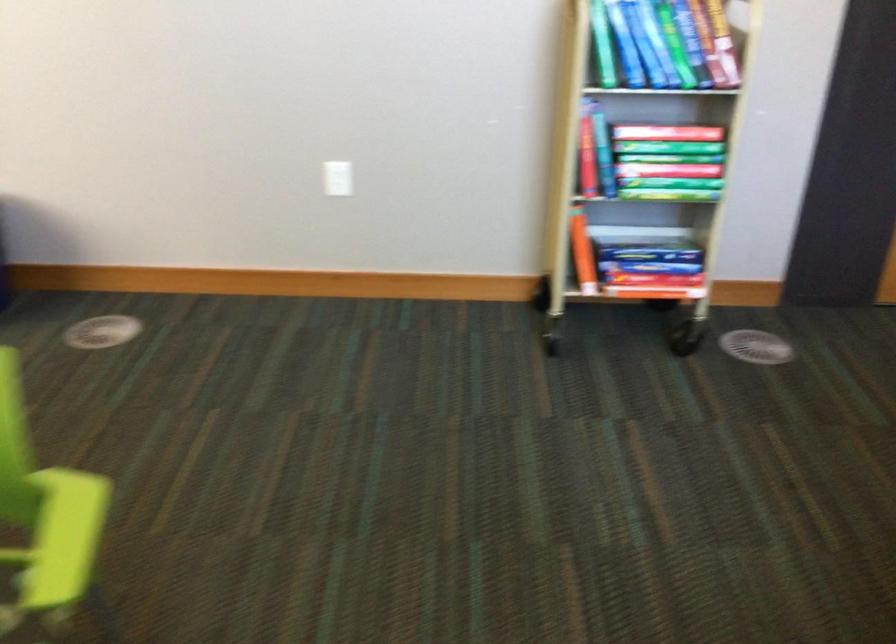
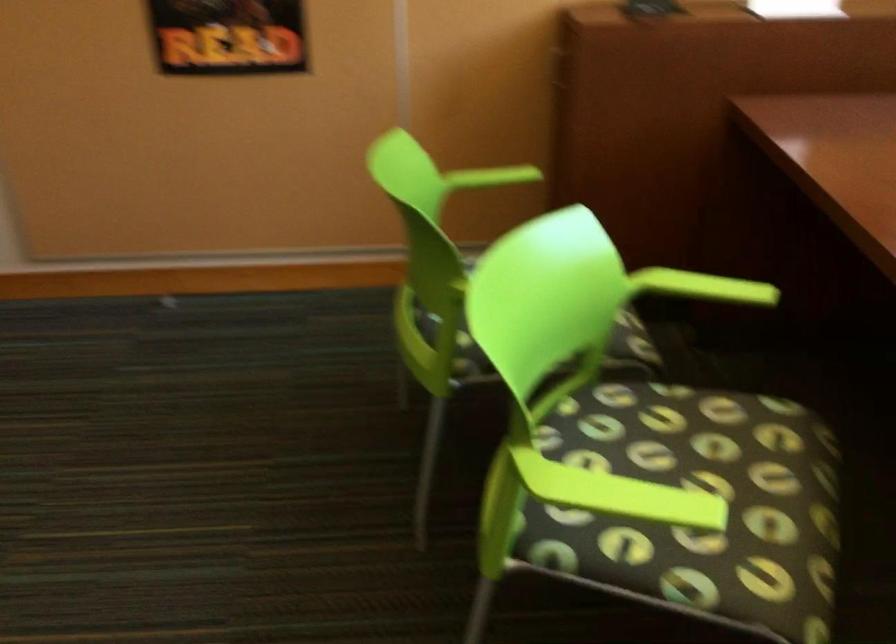
Based on the continuous images, in which direction is the camera rotating?

The rotation direction of the camera is right-down.